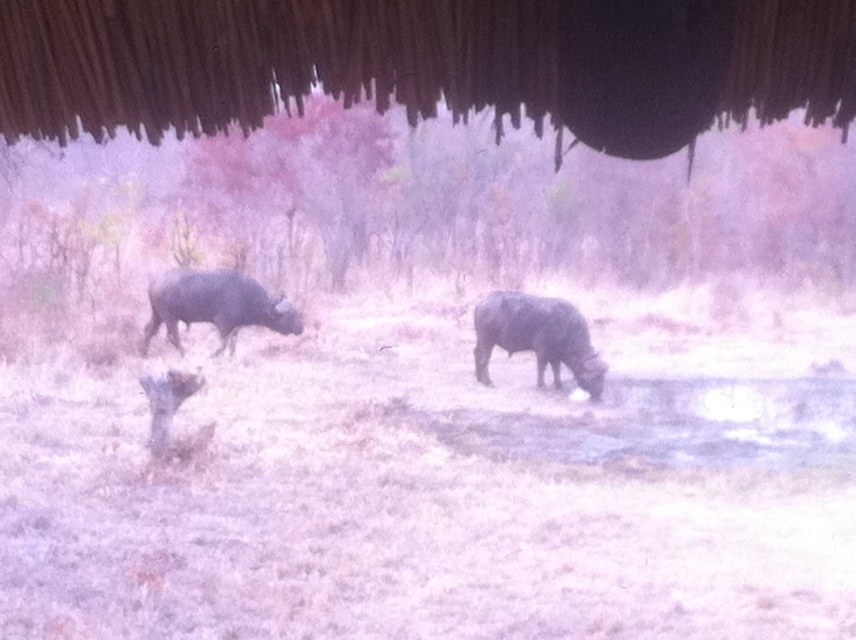
You are a photographer trying to capture a clear photo of the dark gray matte yak at center and the dark gray matte yak at left. Which yak will appear closer to the camera in the photo?

The dark gray matte yak at center will appear closer to the camera because it is positioned in front of the dark gray matte yak at left.

You are standing in a field and see a point marked at coordinates (536, 337). What animal is located at that point?

The dark gray matte yak at center is located at point (536, 337).

You are a wildlife photographer trying to capture a photo of the dark gray matte yak at center and the dark gray matte yak at left. Which yak should you focus on if you want to photograph the larger one?

The dark gray matte yak at center is larger compared to the dark gray matte yak at left, so you should focus on the dark gray matte yak at center.